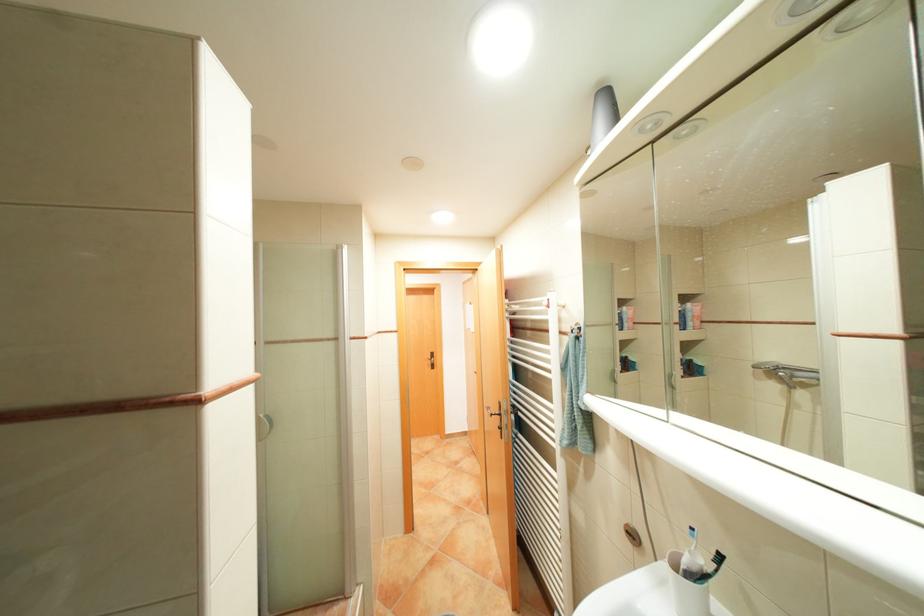
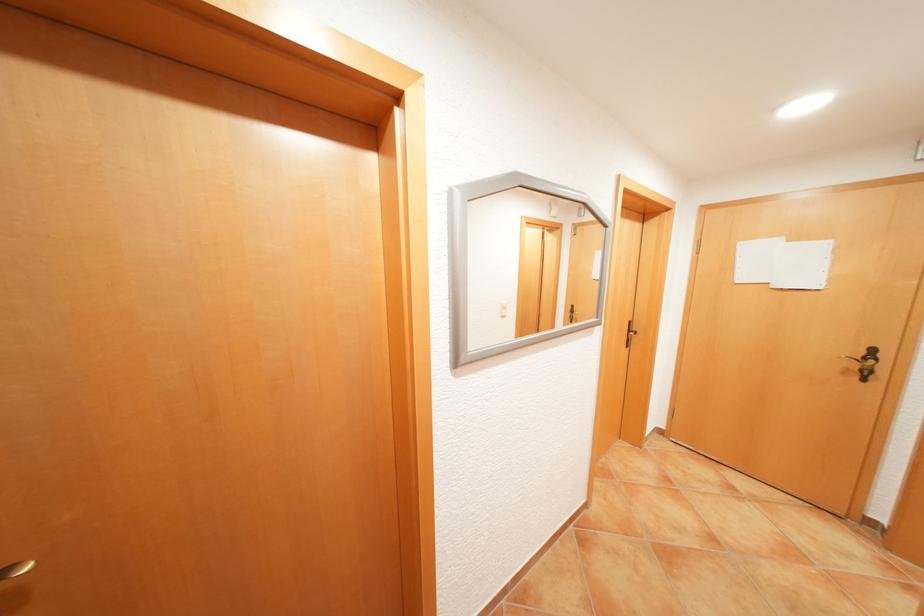
In a continuous first-person perspective shot, in which direction is the camera moving?

The cameraman moved toward left, forward.